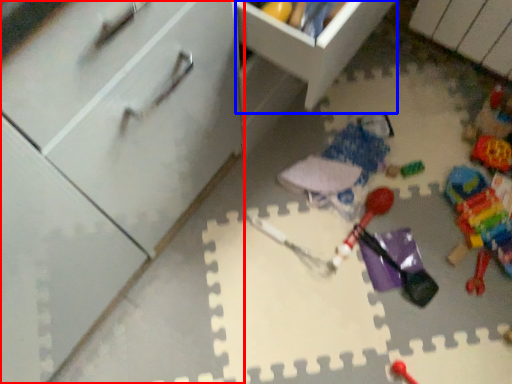
Question: Among these objects, which one is nearest to the camera, cabinetry (highlighted by a red box) or cabinetry (highlighted by a blue box)?

Choices:
 (A) cabinetry
 (B) cabinetry

Answer: (A)